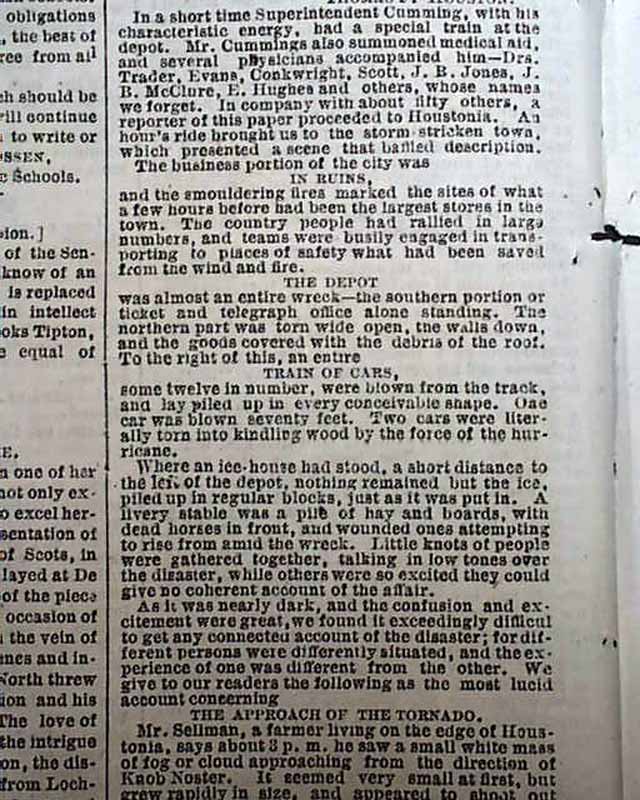
The height and width of the screenshot is (800, 640). In order to click on newspaper in this screenshot , I will do `click(234, 321)`, `click(291, 493)`.